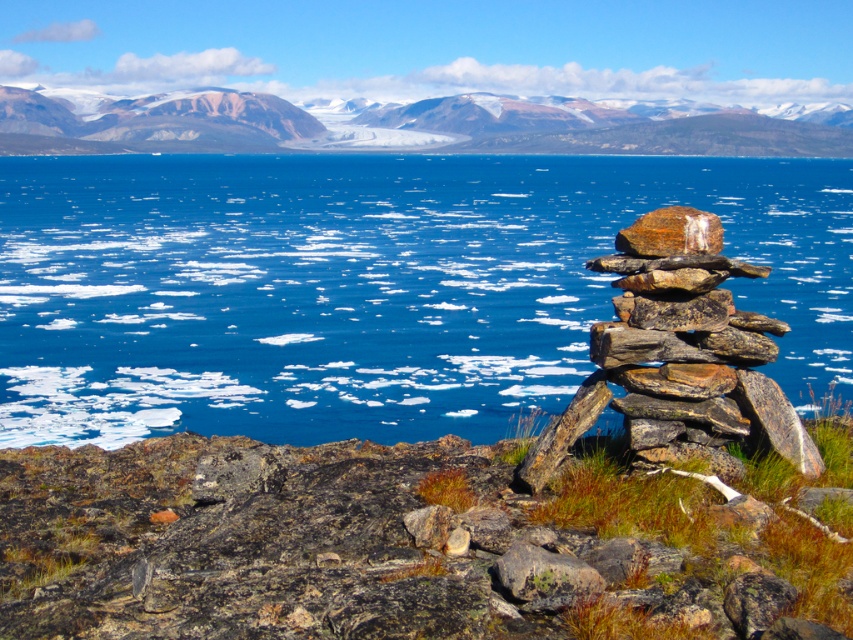
Can you confirm if rusty metallic rock at lower center is thinner than rusty metallic rock at center?

Indeed, rusty metallic rock at lower center has a lesser width compared to rusty metallic rock at center.

Between rusty metallic rock at lower center and rusty metallic rock at center, which one appears on the left side from the viewer's perspective?

rusty metallic rock at lower center is more to the left.

Between point (575, 568) and point (637, 224), which one is positioned in front?

Point (575, 568) is more forward.

Image resolution: width=853 pixels, height=640 pixels. Identify the location of rusty metallic rock at lower center. (544, 572).

Is blue water at center positioned before rugged granite mountain at upper center?

Yes, blue water at center is closer to the viewer.

Locate an element on the screen. blue water at center is located at coordinates (368, 285).

Does rusty rock at lower right have a lesser width compared to rugged granite mountain at upper center?

Yes.

Who is more forward, (329, 596) or (209, 122)?

Point (329, 596) is more forward.

The width and height of the screenshot is (853, 640). I want to click on rusty rock at lower right, so click(410, 541).